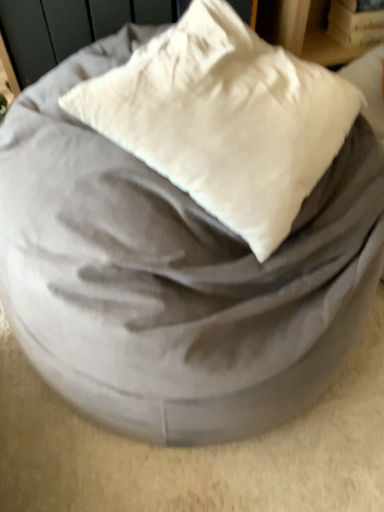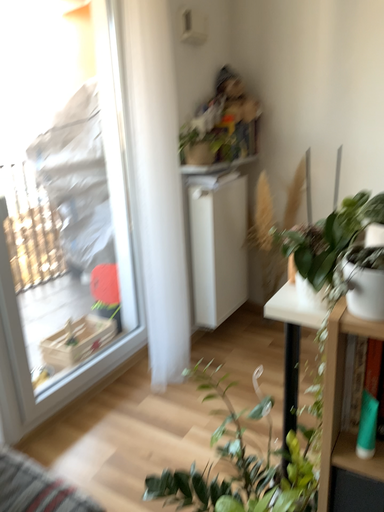
Question: Which way did the camera rotate in the video?

Choices:
 (A) rotated downward
 (B) rotated upward

Answer: (B)